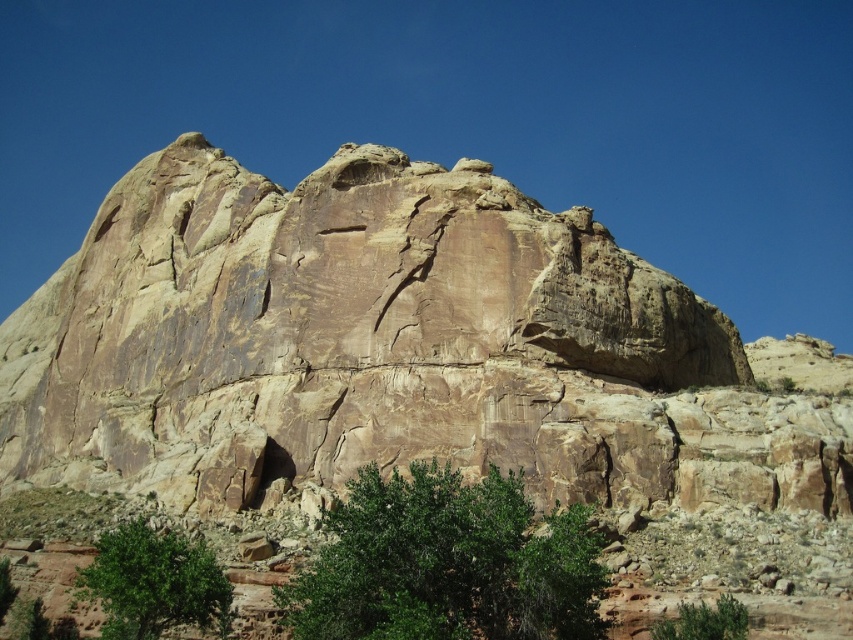
Question: Which point appears farthest from the camera in this image?

Choices:
 (A) (167, 532)
 (B) (695, 611)

Answer: (A)

Question: Is green leafy tree at center thinner than green leafy bush at lower center?

Choices:
 (A) yes
 (B) no

Answer: (B)

Question: Can you confirm if green leafy tree at center is wider than green leafy tree at lower left?

Choices:
 (A) yes
 (B) no

Answer: (A)

Question: Which object is the farthest from the green leafy tree at center?

Choices:
 (A) green leafy bush at lower center
 (B) green leafy tree at lower left

Answer: (A)

Question: Where is green leafy tree at center located in relation to green leafy tree at lower left in the image?

Choices:
 (A) above
 (B) below

Answer: (A)

Question: Among these objects, which one is farthest from the camera?

Choices:
 (A) green leafy tree at center
 (B) green leafy tree at lower left
 (C) green leafy bush at lower center

Answer: (C)